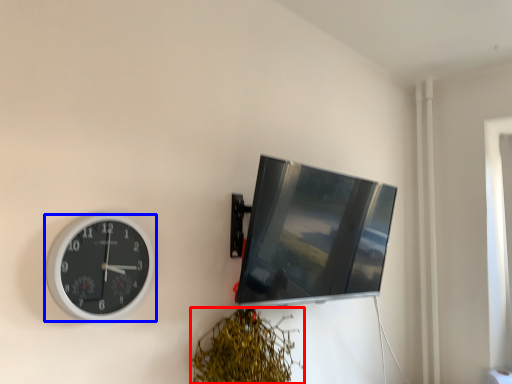
Question: Among these objects, which one is farthest to the camera, vegetation (highlighted by a red box) or wall clock (highlighted by a blue box)?

Choices:
 (A) vegetation
 (B) wall clock

Answer: (A)